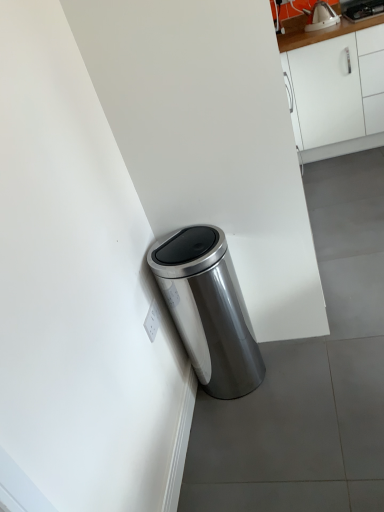
Question: In terms of height, does satin silver trash can at lower left look taller or shorter compared to metallic silver kettle at upper right?

Choices:
 (A) tall
 (B) short

Answer: (A)

Question: From a real-world perspective, relative to metallic silver kettle at upper right, is satin silver trash can at lower left vertically above or below?

Choices:
 (A) below
 (B) above

Answer: (A)

Question: Based on their relative distances, which object is nearer to the metallic silver kettle at upper right?

Choices:
 (A) satin silver trash can at lower left
 (B) white plastic electric outlet at lower left
 (C) white matte cabinet at upper right

Answer: (C)

Question: Which object is the farthest from the white matte cabinet at upper right?

Choices:
 (A) satin silver trash can at lower left
 (B) white plastic electric outlet at lower left
 (C) metallic silver kettle at upper right

Answer: (B)